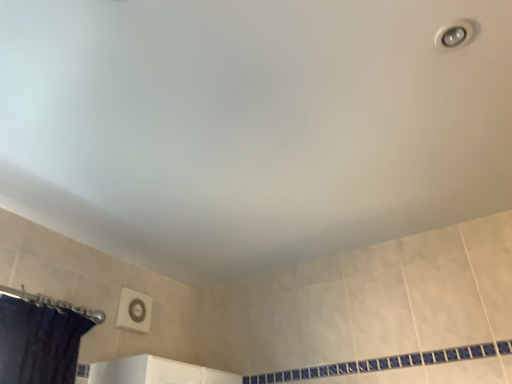
Describe the element at coordinates (454, 34) in the screenshot. I see `white glossy droplight at upper right` at that location.

The width and height of the screenshot is (512, 384). Identify the location of white glossy droplight at upper right. (454, 34).

You are a GUI agent. You are given a task and a screenshot of the screen. Output one action in this format:
    pyautogui.click(x=<x>, y=<y>)
    Task: Click on the white glossy droplight at upper right
    This screenshot has height=384, width=512.
    Given the screenshot: What is the action you would take?
    pyautogui.click(x=454, y=34)